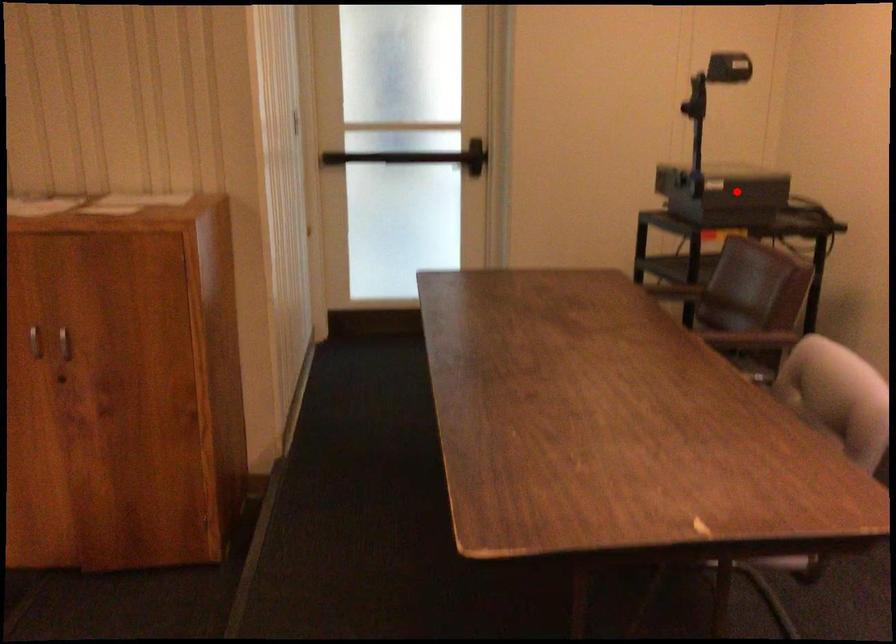
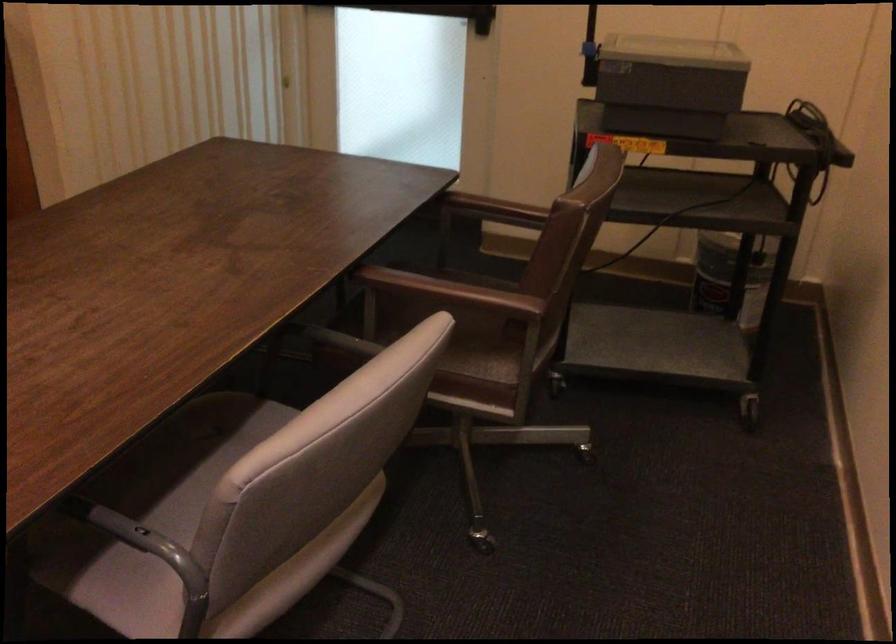
Question: I am providing you with two images of the same scene from different viewpoints. Given a red point in image1, look at the same physical point in image2. Is it:

Choices:
 (A) Closer to the viewpoint
 (B) Farther from the viewpoint

Answer: (A)